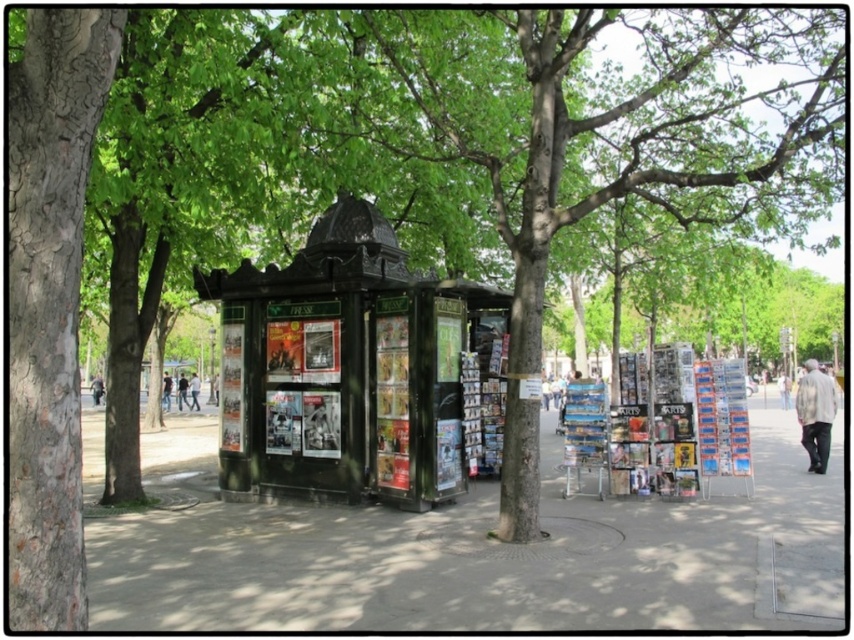
Is black glossy kiosk at center positioned before smooth gray bark at left?

No, it is not.

Consider the image. Who is more distant from viewer, (237, 429) or (45, 124)?

Point (237, 429)

The image size is (854, 640). I want to click on black glossy kiosk at center, so click(344, 368).

Who is higher up, smooth concrete sidewalk at center or black glossy kiosk at center?

black glossy kiosk at center is above.

This screenshot has width=854, height=640. I want to click on smooth concrete sidewalk at center, so click(478, 554).

You are a GUI agent. You are given a task and a screenshot of the screen. Output one action in this format:
    pyautogui.click(x=<x>, y=<y>)
    Task: Click on the smooth concrete sidewalk at center
    
    Given the screenshot: What is the action you would take?
    pyautogui.click(x=478, y=554)

Is smooth concrete sidewalk at center to the left of smooth gray bark at left from the viewer's perspective?

No, smooth concrete sidewalk at center is not to the left of smooth gray bark at left.

You are a GUI agent. You are given a task and a screenshot of the screen. Output one action in this format:
    pyautogui.click(x=<x>, y=<y>)
    Task: Click on the smooth concrete sidewalk at center
    Image resolution: width=854 pixels, height=640 pixels.
    Given the screenshot: What is the action you would take?
    pyautogui.click(x=478, y=554)

Image resolution: width=854 pixels, height=640 pixels. Identify the location of smooth concrete sidewalk at center. (478, 554).